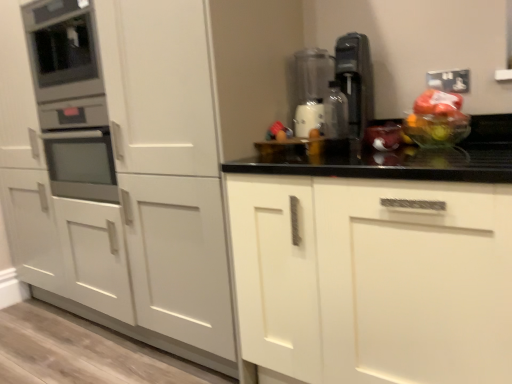
The image size is (512, 384). Describe the element at coordinates (355, 79) in the screenshot. I see `satin silver coffee machine at upper right` at that location.

What is the approximate height of metallic silver bottle at center?

10.62 inches.

Describe the element at coordinates (383, 136) in the screenshot. I see `translucent plastic bag at center` at that location.

The height and width of the screenshot is (384, 512). What are the coordinates of `translucent plastic bag at center` in the screenshot? It's located at (383, 136).

The width and height of the screenshot is (512, 384). Describe the element at coordinates (150, 165) in the screenshot. I see `white matte cabinet at center, arranged as the 1th cabinetry when viewed from the left` at that location.

The height and width of the screenshot is (384, 512). Find the location of `white matte cabinet at center, positioned as the second cabinetry in right-to-left order`. white matte cabinet at center, positioned as the second cabinetry in right-to-left order is located at coordinates click(x=150, y=165).

Find the location of a particular element. metallic oven at left, placed as the second appliance when sorted from right to left is located at coordinates (62, 49).

Image resolution: width=512 pixels, height=384 pixels. Describe the element at coordinates (374, 279) in the screenshot. I see `white matte cabinet at center, the first cabinetry viewed from the right` at that location.

Describe the element at coordinates (437, 120) in the screenshot. I see `translucent plastic bag of fruit at right` at that location.

Locate an element on the screen. Image resolution: width=512 pixels, height=384 pixels. transparent plastic blender at center, the 1th appliance positioned from the right is located at coordinates (311, 89).

From a real-world perspective, is translucent plastic bag at center physically above metallic silver bottle at center?

Incorrect, from a real-world perspective, translucent plastic bag at center is lower than metallic silver bottle at center.

Does point (369, 133) lie behind point (342, 137)?

No, (369, 133) is closer to viewer.

Where is `bottle located on the left of translucent plastic bag at center`? The image size is (512, 384). bottle located on the left of translucent plastic bag at center is located at coordinates point(335,113).

Considering the relative positions of translucent plastic bag at center and metallic silver bottle at center in the image provided, is translucent plastic bag at center to the right of metallic silver bottle at center from the viewer's perspective?

Indeed, translucent plastic bag at center is positioned on the right side of metallic silver bottle at center.

The image size is (512, 384). What are the coordinates of `kitchen appliance located on the right of transparent plastic blender at center, which is the 2th appliance from left to right` in the screenshot? It's located at [x=355, y=79].

Is satin silver coffee machine at upper right facing towards transparent plastic blender at center, the 1th appliance positioned from the right?

No, satin silver coffee machine at upper right is not facing towards transparent plastic blender at center, the 1th appliance positioned from the right.

From the image's perspective, relative to transparent plastic blender at center, the 1th appliance positioned from the right, is satin silver coffee machine at upper right above or below?

From the image's perspective, satin silver coffee machine at upper right appears below transparent plastic blender at center, the 1th appliance positioned from the right.

From the image's perspective, is transparent plastic blender at center, the 1th appliance positioned from the right, located beneath metallic oven at left, positioned as the 1th appliance in left-to-right order?

Yes, from the image's perspective, transparent plastic blender at center, the 1th appliance positioned from the right, is below metallic oven at left, positioned as the 1th appliance in left-to-right order.

From the picture: Is transparent plastic blender at center, the 1th appliance positioned from the right, facing towards metallic oven at left, placed as the second appliance when sorted from right to left?

No, transparent plastic blender at center, the 1th appliance positioned from the right, is not turned towards metallic oven at left, placed as the second appliance when sorted from right to left.

Which is more to the left, transparent plastic blender at center, which is the 2th appliance from left to right, or metallic oven at left, placed as the second appliance when sorted from right to left?

metallic oven at left, placed as the second appliance when sorted from right to left, is more to the left.

Based on the photo, does metallic oven at left, positioned as the 1th appliance in left-to-right order, have a lesser height compared to metallic silver bottle at center?

In fact, metallic oven at left, positioned as the 1th appliance in left-to-right order, may be taller than metallic silver bottle at center.

From the image's perspective, is metallic oven at left, placed as the second appliance when sorted from right to left, located above or below metallic silver bottle at center?

metallic oven at left, placed as the second appliance when sorted from right to left, is above metallic silver bottle at center.

Where is `the 2nd appliance above the metallic silver bottle at center (from the image's perspective)`? The width and height of the screenshot is (512, 384). the 2nd appliance above the metallic silver bottle at center (from the image's perspective) is located at coordinates (62, 49).

Who is bigger, metallic oven at left, placed as the second appliance when sorted from right to left, or metallic silver bottle at center?

Bigger between the two is metallic oven at left, placed as the second appliance when sorted from right to left.

Find the location of a particular element. The width and height of the screenshot is (512, 384). food below the metallic silver bottle at center (from a real-world perspective) is located at coordinates (383, 136).

Is metallic silver bottle at center aimed at translucent plastic bag at center?

No, metallic silver bottle at center does not turn towards translucent plastic bag at center.

Looking at this image, how many degrees apart are the facing directions of metallic silver bottle at center and translucent plastic bag at center?

1.18 degrees.

Who is smaller, metallic silver bottle at center or translucent plastic bag at center?

Result: With smaller size is metallic silver bottle at center.

Between transparent plastic blender at center, which is the 2th appliance from left to right, and white matte cabinet at center, positioned as the second cabinetry in right-to-left order, which one appears on the right side from the viewer's perspective?

transparent plastic blender at center, which is the 2th appliance from left to right, is more to the right.

From a real-world perspective, who is located higher, transparent plastic blender at center, the 1th appliance positioned from the right, or white matte cabinet at center, arranged as the 1th cabinetry when viewed from the left?

In real-world perspective, transparent plastic blender at center, the 1th appliance positioned from the right, is above.

The image size is (512, 384). Identify the location of the 1st appliance positioned above the white matte cabinet at center, positioned as the second cabinetry in right-to-left order (from the image's perspective). (311, 89).

From the image's perspective, which one is positioned higher, transparent plastic blender at center, the 1th appliance positioned from the right, or white matte cabinet at center, arranged as the 1th cabinetry when viewed from the left?

From the image's view, transparent plastic blender at center, the 1th appliance positioned from the right, is above.

Does metallic oven at left, placed as the second appliance when sorted from right to left, have a smaller size compared to transparent plastic blender at center, the 1th appliance positioned from the right?

Incorrect, metallic oven at left, placed as the second appliance when sorted from right to left, is not smaller in size than transparent plastic blender at center, the 1th appliance positioned from the right.

Is metallic oven at left, placed as the second appliance when sorted from right to left, wider or thinner than transparent plastic blender at center, the 1th appliance positioned from the right?

Considering their sizes, metallic oven at left, placed as the second appliance when sorted from right to left, looks broader than transparent plastic blender at center, the 1th appliance positioned from the right.

Can you confirm if metallic oven at left, positioned as the 1th appliance in left-to-right order, is positioned to the right of transparent plastic blender at center, which is the 2th appliance from left to right?

No, metallic oven at left, positioned as the 1th appliance in left-to-right order, is not to the right of transparent plastic blender at center, which is the 2th appliance from left to right.

Is transparent plastic blender at center, the 1th appliance positioned from the right, completely or partially inside metallic oven at left, placed as the second appliance when sorted from right to left?

That's incorrect, transparent plastic blender at center, the 1th appliance positioned from the right, is not inside metallic oven at left, placed as the second appliance when sorted from right to left.

Locate an element on the screen. This screenshot has width=512, height=384. food on the right side of metallic silver bottle at center is located at coordinates (383, 136).

Locate an element on the screen. Image resolution: width=512 pixels, height=384 pixels. kitchen appliance that appears below the transparent plastic blender at center, which is the 2th appliance from left to right (from a real-world perspective) is located at coordinates (355, 79).

Looking at the image, which one is located closer to white matte cabinet at center, positioned as the second cabinetry in right-to-left order, metallic oven at left, placed as the second appliance when sorted from right to left, or transparent plastic blender at center, which is the 2th appliance from left to right?

metallic oven at left, placed as the second appliance when sorted from right to left, is closer to white matte cabinet at center, positioned as the second cabinetry in right-to-left order.

Which object lies further to the anchor point satin silver coffee machine at upper right, transparent plastic blender at center, the 1th appliance positioned from the right, or metallic oven at left, positioned as the 1th appliance in left-to-right order?

Based on the image, metallic oven at left, positioned as the 1th appliance in left-to-right order, appears to be further to satin silver coffee machine at upper right.

Looking at the image, which one is located closer to translucent plastic bag at center, metallic oven at left, placed as the second appliance when sorted from right to left, or white matte cabinet at center, arranged as the 1th cabinetry when viewed from the left?

white matte cabinet at center, arranged as the 1th cabinetry when viewed from the left, is closer to translucent plastic bag at center.

When comparing their distances from metallic oven at left, positioned as the 1th appliance in left-to-right order, does metallic silver bottle at center or white matte cabinet at center, which appears as the second cabinetry when viewed from the left, seem further?

white matte cabinet at center, which appears as the second cabinetry when viewed from the left, is positioned further to the anchor metallic oven at left, positioned as the 1th appliance in left-to-right order.

From the picture: Considering their positions, is white matte cabinet at center, positioned as the second cabinetry in right-to-left order, positioned closer to white matte cabinet at center, the first cabinetry viewed from the right, than satin silver coffee machine at upper right?

satin silver coffee machine at upper right lies closer to white matte cabinet at center, the first cabinetry viewed from the right, than the other object.

From the image, which object appears to be farther from white matte cabinet at center, positioned as the second cabinetry in right-to-left order, white matte cabinet at center, which appears as the second cabinetry when viewed from the left, or metallic oven at left, positioned as the 1th appliance in left-to-right order?

white matte cabinet at center, which appears as the second cabinetry when viewed from the left, is further to white matte cabinet at center, positioned as the second cabinetry in right-to-left order.

Looking at the image, which one is located closer to satin silver coffee machine at upper right, translucent plastic bag at center or transparent plastic blender at center, the 1th appliance positioned from the right?

Based on the image, translucent plastic bag at center appears to be nearer to satin silver coffee machine at upper right.

Considering their positions, is transparent plastic blender at center, which is the 2th appliance from left to right, positioned further to satin silver coffee machine at upper right than metallic silver bottle at center?

Among the two, transparent plastic blender at center, which is the 2th appliance from left to right, is located further to satin silver coffee machine at upper right.

At what (x,y) coordinates should I click in order to perform the action: click on food between satin silver coffee machine at upper right and translucent plastic bag of fruit at right from left to right. Please return your answer as a coordinate pair (x, y). The width and height of the screenshot is (512, 384). Looking at the image, I should click on (383, 136).

Image resolution: width=512 pixels, height=384 pixels. I want to click on kitchen appliance located between metallic oven at left, placed as the second appliance when sorted from right to left, and translucent plastic bag of fruit at right in the left-right direction, so click(x=355, y=79).

Where is `bottle situated between transparent plastic blender at center, which is the 2th appliance from left to right, and translucent plastic bag at center from left to right`? The image size is (512, 384). bottle situated between transparent plastic blender at center, which is the 2th appliance from left to right, and translucent plastic bag at center from left to right is located at coordinates (335, 113).

This screenshot has height=384, width=512. In order to click on kitchen appliance between white matte cabinet at center, arranged as the 1th cabinetry when viewed from the left, and translucent plastic bag of fruit at right, in the horizontal direction in this screenshot , I will do `click(355, 79)`.